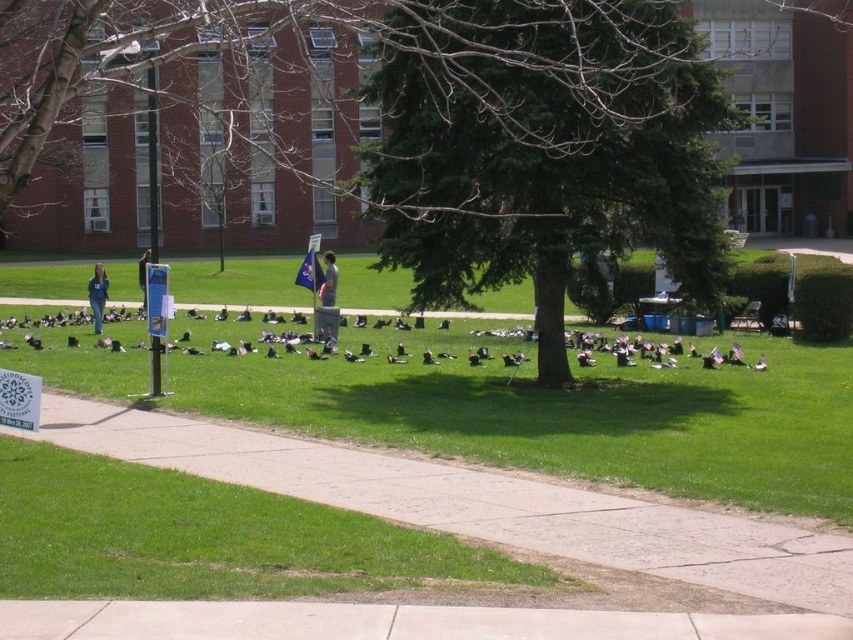
Question: Can you confirm if green textured tree at center is positioned below concrete sidewalk at center?

Choices:
 (A) yes
 (B) no

Answer: (B)

Question: Estimate the real-world distances between objects in this image. Which object is farther from the green textured tree at center?

Choices:
 (A) black matte shoes at center
 (B) concrete at center

Answer: (B)

Question: Can you confirm if green textured tree at center is positioned below concrete sidewalk at center?

Choices:
 (A) yes
 (B) no

Answer: (B)

Question: In this image, where is green textured tree at center located relative to concrete sidewalk at center?

Choices:
 (A) right
 (B) left

Answer: (A)

Question: Estimate the real-world distances between objects in this image. Which object is farther from the black matte shoes at center?

Choices:
 (A) concrete at center
 (B) concrete sidewalk at center
 (C) green grass at center
 (D) green textured tree at center

Answer: (A)

Question: Based on their relative distances, which object is nearer to the concrete at center?

Choices:
 (A) green textured tree at center
 (B) black matte shoes at center
 (C) concrete sidewalk at center

Answer: (C)